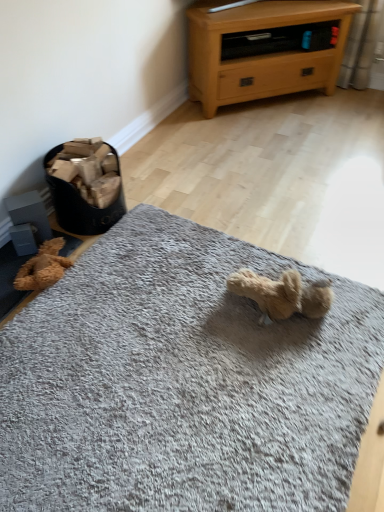
Question: Is gray soft rug at center taller or shorter than light oak wood chest of drawers at upper right?

Choices:
 (A) short
 (B) tall

Answer: (A)

Question: Does point (271, 502) appear closer or farther from the camera than point (241, 15)?

Choices:
 (A) closer
 (B) farther

Answer: (A)

Question: Estimate the real-world distances between objects in this image. Which object is closer to the gray soft rug at center?

Choices:
 (A) brown plush teddy bear at lower left
 (B) light oak wood chest of drawers at upper right

Answer: (A)

Question: Which object is positioned closest to the brown plush teddy bear at lower left?

Choices:
 (A) light oak wood chest of drawers at upper right
 (B) gray soft rug at center

Answer: (B)